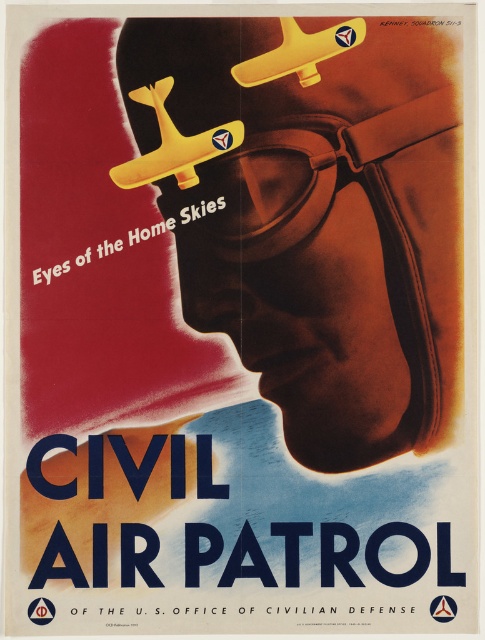
Question: Which of the following is the farthest from the observer?

Choices:
 (A) (340, 35)
 (B) (435, 605)

Answer: (A)

Question: From the image, what is the correct spatial relationship of metallic star at center in relation to metallic red star at center?

Choices:
 (A) left
 (B) right

Answer: (B)

Question: Is metallic star at center to the right of metallic red star at center from the viewer's perspective?

Choices:
 (A) no
 (B) yes

Answer: (B)

Question: Which of the following is the closest to the observer?

Choices:
 (A) metallic star at center
 (B) metallic red star at center

Answer: (A)

Question: Does metallic star at center have a smaller size compared to metallic red star at center?

Choices:
 (A) yes
 (B) no

Answer: (B)